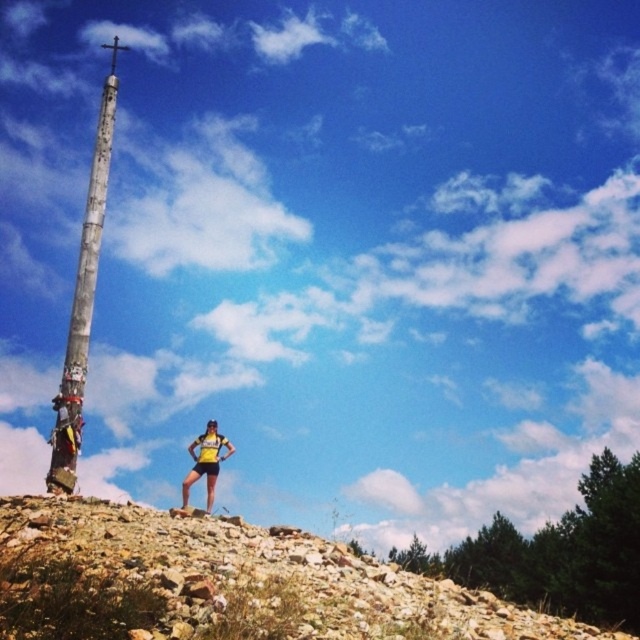
Question: Which point is farther to the camera?

Choices:
 (A) yellow fabric shorts at center
 (B) brown rocky hillside at lower left

Answer: (A)

Question: Does brown rocky hillside at lower left have a smaller size compared to yellow fabric shorts at center?

Choices:
 (A) no
 (B) yes

Answer: (A)

Question: Does brown rocky hillside at lower left appear on the left side of weathered wooden pole at left?

Choices:
 (A) no
 (B) yes

Answer: (A)

Question: Is brown rocky hillside at lower left behind weathered wooden pole at left?

Choices:
 (A) no
 (B) yes

Answer: (A)

Question: Among these objects, which one is farthest from the camera?

Choices:
 (A) weathered wooden pole at left
 (B) yellow fabric shorts at center

Answer: (B)

Question: Which point is farther to the camera?

Choices:
 (A) (48, 476)
 (B) (204, 461)
 (C) (76, 502)

Answer: (B)